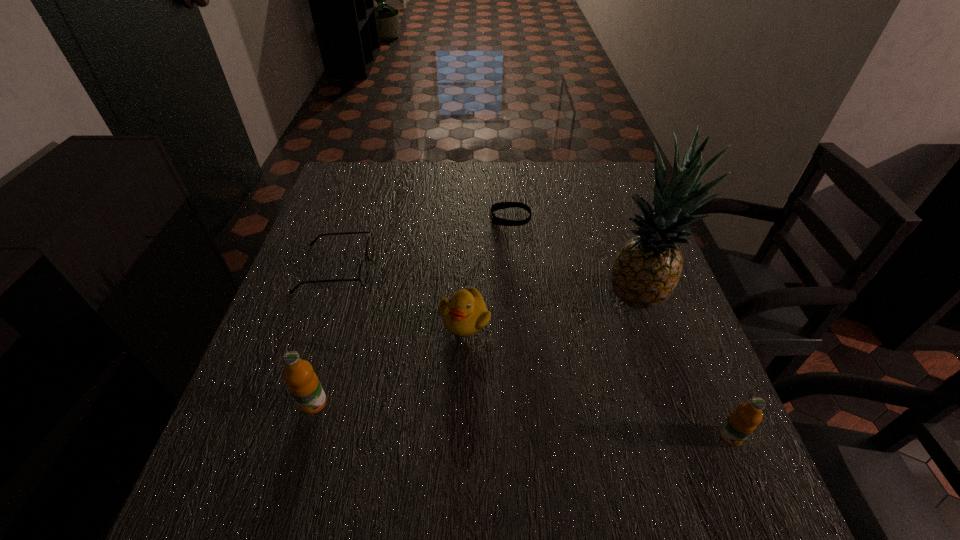
To ensure equal spacing by inserting another orange_juice among them, please point out a vacant spot for this new orange_juice. Please provide its 2D coordinates. Your answer should be formatted as a tuple, i.e. [(x, y)], where the tuple contains the x and y coordinates of a point satisfying the conditions above.

[(516, 420)]